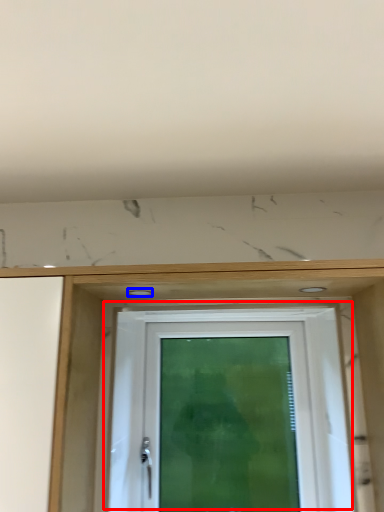
Question: Which object is closer to the camera taking this photo, door (highlighted by a red box) or hole (highlighted by a blue box)?

Choices:
 (A) door
 (B) hole

Answer: (B)